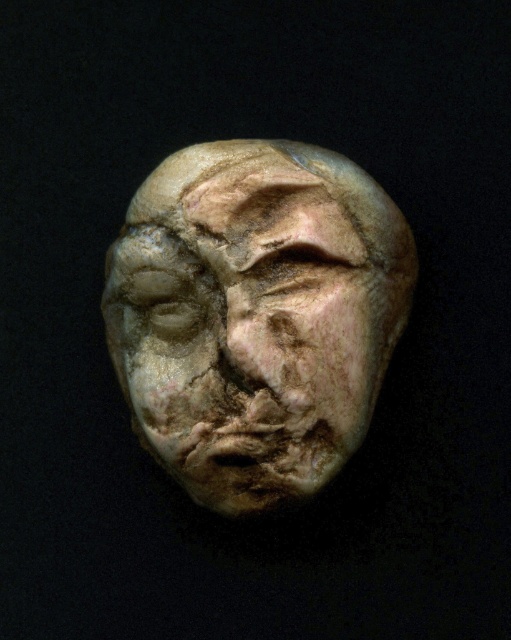
Question: Does matte stone face at center appear over matte stone forehead at upper center?

Choices:
 (A) no
 (B) yes

Answer: (A)

Question: From the image, what is the correct spatial relationship of matte stone face at center in relation to matte stone forehead at upper center?

Choices:
 (A) left
 (B) right

Answer: (A)

Question: Is matte stone face at center positioned behind matte stone forehead at upper center?

Choices:
 (A) no
 (B) yes

Answer: (A)